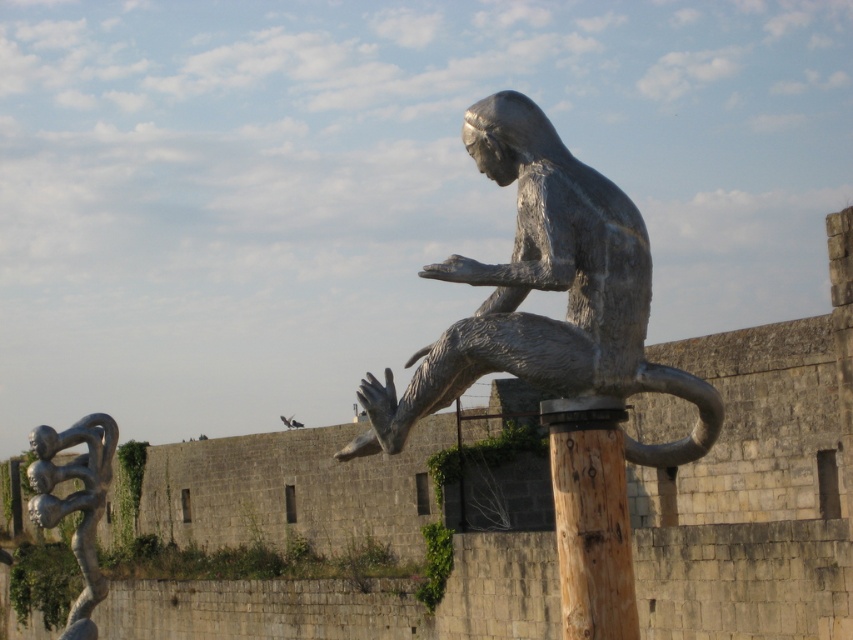
You are an artist planning to install a new sculpture in this outdoor space. The new sculpture is 1.5 meters tall. You want to place it so that it doesn not block the view of the polished bronze statue at center. Based on the current arrangement, can you place the new sculpture next to the brown wood pole at center without obstructing the view of the statue?

The polished bronze statue at center is taller than the brown wood pole at center. Since the new sculpture is 1.5 meters tall, placing it next to the brown wood pole at center would not block the view of the statue as long as the new sculpture is shorter than the statue. However, the height of the statue is not provided, so we cannot confirm if 1.5 meters is shorter than the statue. Therefore, it is uncertain whether the new sculpture will block the view.

You are a visitor standing in front of the two sculptures. You notice the brown wood pole at center and the polished silver figure at lower left. Which object is positioned higher in the scene?

The brown wood pole at center is above the polished silver figure at lower left, so it is positioned higher in the scene.

In the scene shown: You are an art curator planning to display these sculptures in a gallery. The polished bronze statue at center and the polished silver figure at lower left need to be arranged so that the taller one is placed at the entrance for visibility. Which sculpture should be placed at the entrance?

The polished silver figure at lower left should be placed at the entrance because it is taller than the polished bronze statue at center.